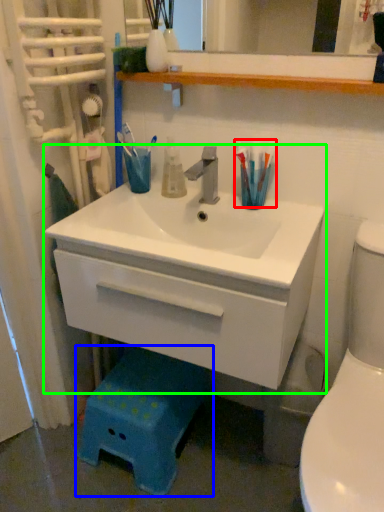
Question: Based on their relative distances, which object is nearer to toothbrush (highlighted by a red box)? Choose from step stool (highlighted by a blue box) and bathroom cabinet (highlighted by a green box).

Choices:
 (A) step stool
 (B) bathroom cabinet

Answer: (B)